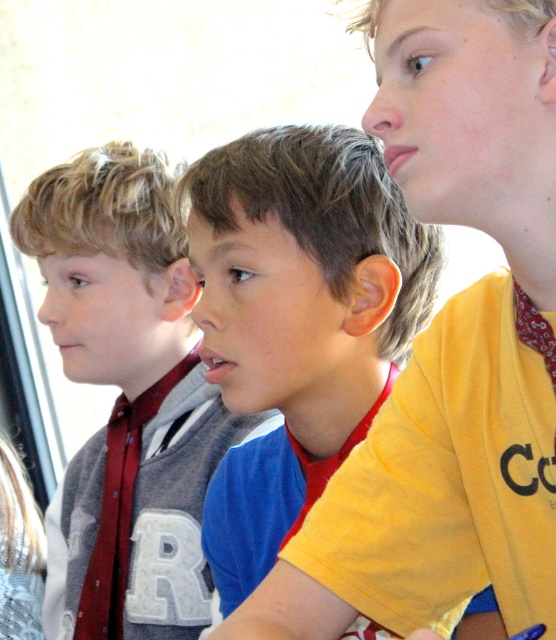
Question: Which of the following is the closest to the observer?

Choices:
 (A) (67, 282)
 (B) (115, 481)
 (C) (260, 374)

Answer: (C)

Question: Which point is closer to the camera taking this photo?

Choices:
 (A) (180, 326)
 (B) (240, 516)

Answer: (B)

Question: Is yellow matte shirt at center above matte red tie at left?

Choices:
 (A) no
 (B) yes

Answer: (B)

Question: Which of the following is the farthest from the observer?

Choices:
 (A) gray fleece sweater at left
 (B) matte red tie at left

Answer: (B)

Question: Does yellow matte shirt at center appear under gray fleece sweater at left?

Choices:
 (A) no
 (B) yes

Answer: (A)

Question: Can you confirm if yellow matte shirt at center is bigger than matte red tie at left?

Choices:
 (A) no
 (B) yes

Answer: (B)